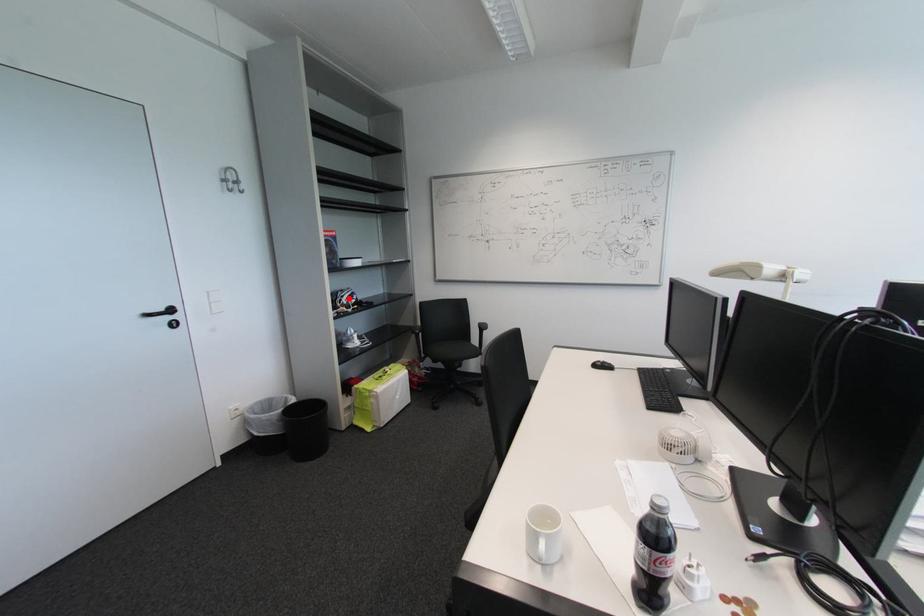
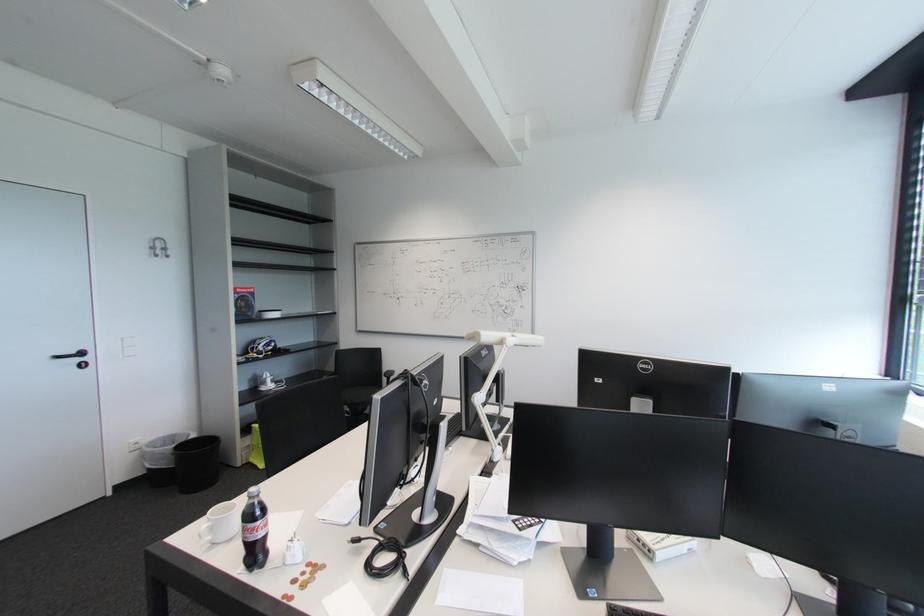
Where in the second image is the point corresponding to the highlighted location from the first image?

(265, 346)